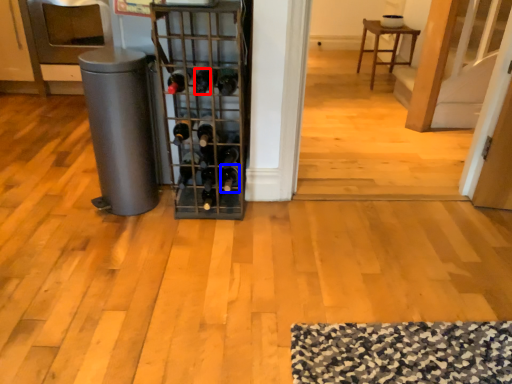
Question: Which of the following is the closest to the observer, wine bottle (highlighted by a red box) or wine bottle (highlighted by a blue box)?

Choices:
 (A) wine bottle
 (B) wine bottle

Answer: (A)